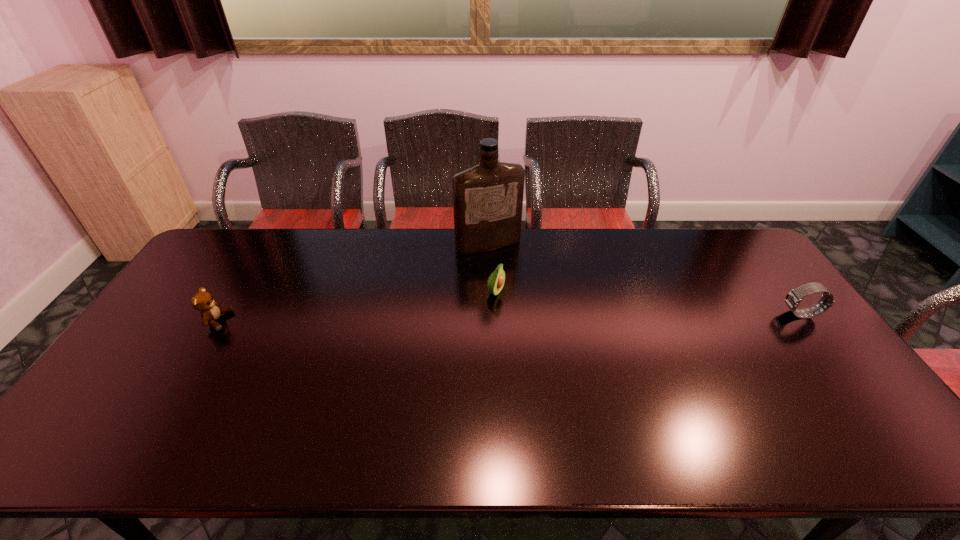
The width and height of the screenshot is (960, 540). I want to click on vacant space located on the label side of the farthest object, so click(x=509, y=271).

Locate an element on the screen. This screenshot has height=540, width=960. free space located on the label side of the farthest object is located at coordinates (544, 327).

Locate an element on the screen. vacant space located 0.390m on the cut side of the second farthest object is located at coordinates click(628, 347).

At what (x,y) coordinates should I click in order to perform the action: click on free space located 0.100m on the cut side of the second farthest object. Please return your answer as a coordinate pair (x, y). This screenshot has width=960, height=540. Looking at the image, I should click on (533, 308).

In order to click on vacant space located 0.330m on the cut side of the second farthest object in this screenshot , I will do `click(607, 338)`.

This screenshot has width=960, height=540. I want to click on object that is at the far edge, so click(x=488, y=198).

The height and width of the screenshot is (540, 960). Identify the location of object located in the left edge section of the desktop. (202, 301).

Where is `object that is at the right edge`? The image size is (960, 540). object that is at the right edge is located at coordinates (794, 297).

At what (x,y) coordinates should I click in order to perform the action: click on vacant area at the far edge. Please return your answer as a coordinate pair (x, y). Looking at the image, I should click on (609, 268).

In the image, there is a desktop. Where is `free region at the near edge`? This screenshot has height=540, width=960. free region at the near edge is located at coordinates (625, 415).